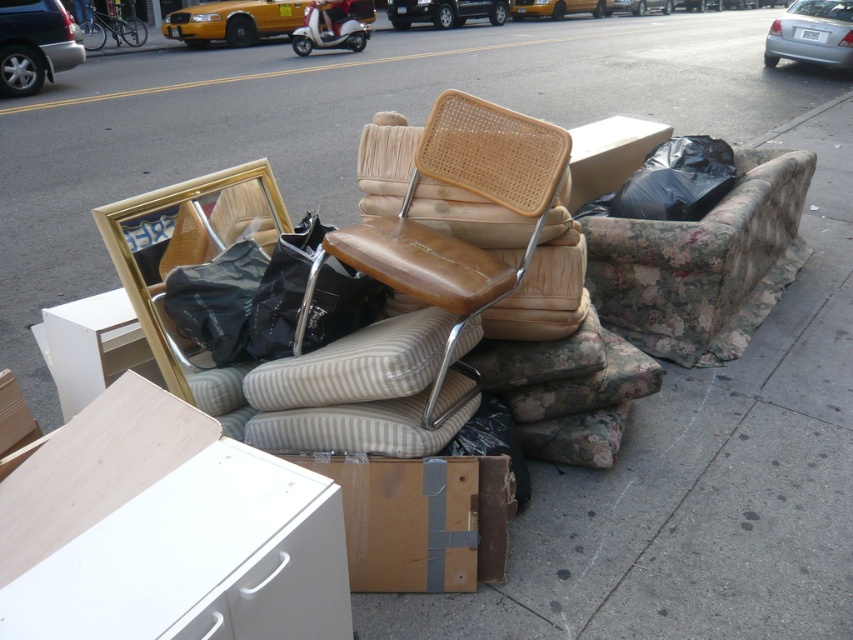
You are standing at the curb of the sidewalk where the discarded furniture is placed. You see a point marked at coordinates (x=701, y=262). Which furniture item is located at that point?

The point at (x=701, y=262) marks the floral fabric couch at center.

You are a delivery person trying to place a new package on the sidewalk where the brown cardboard box at lower center and the black plastic bag at upper right are located. Can you put the new package between them without moving either item?

The brown cardboard box at lower center is in front of the black plastic bag at upper right, so there is space between them for the new package to be placed in between without moving either item.

You are a delivery person trying to move a large package through the sidewalk. You see the floral fabric couch at center and the brown leather swivel chair at center. Which object is taller and might block your path?

The floral fabric couch at center is taller than the brown leather swivel chair at center, so it might block your path more significantly.